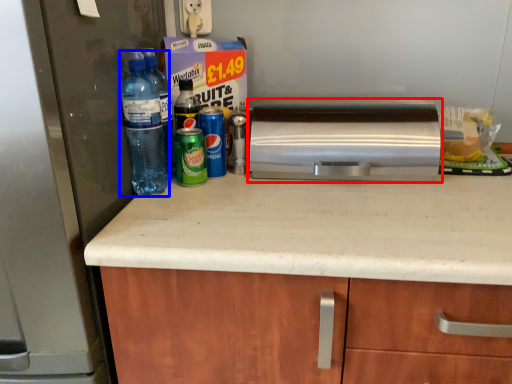
Question: Among these objects, which one is farthest to the camera, home appliance (highlighted by a red box) or bottle (highlighted by a blue box)?

Choices:
 (A) home appliance
 (B) bottle

Answer: (A)